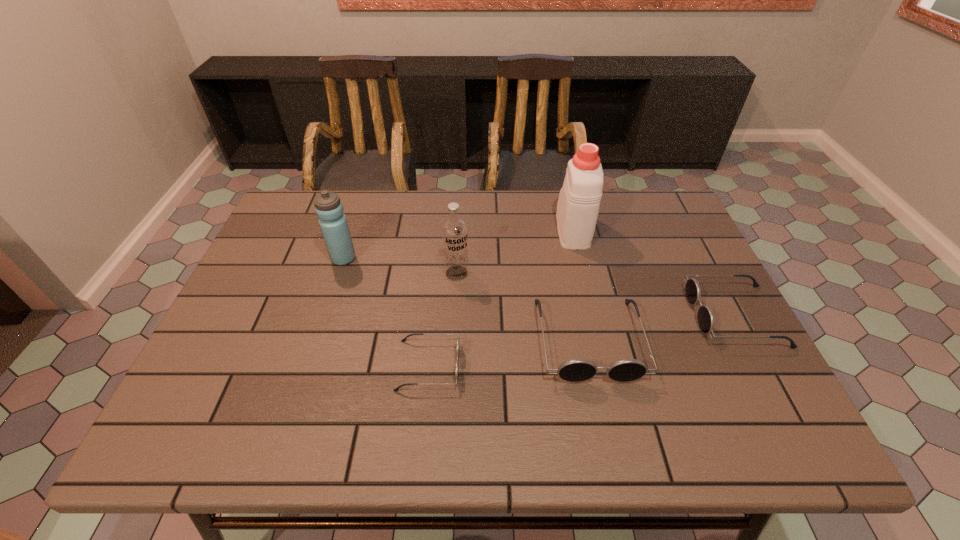
You are a GUI agent. You are given a task and a screenshot of the screen. Output one action in this format:
    pyautogui.click(x=<x>, y=<y>)
    Task: Click on the leftmost sunglasses
    The width and height of the screenshot is (960, 540).
    Given the screenshot: What is the action you would take?
    [x=458, y=339]

Locate an element on the screen. The height and width of the screenshot is (540, 960). the shortest object is located at coordinates (458, 339).

This screenshot has height=540, width=960. I want to click on the second sunglasses from left to right, so tap(576, 370).

Where is `the rightmost object`? This screenshot has height=540, width=960. the rightmost object is located at coordinates (706, 321).

Identify the location of the second shortest object. (706, 321).

Image resolution: width=960 pixels, height=540 pixels. I want to click on the tallest object, so click(x=578, y=205).

Find the location of `the farthest object`. the farthest object is located at coordinates (578, 205).

Locate an element on the screen. Image resolution: width=960 pixels, height=540 pixels. the leftmost object is located at coordinates (333, 223).

The height and width of the screenshot is (540, 960). Identify the location of vodka. (454, 231).

Identify the location of free space located on the front-facing side of the shortest sunglasses. This screenshot has width=960, height=540. coord(499,365).